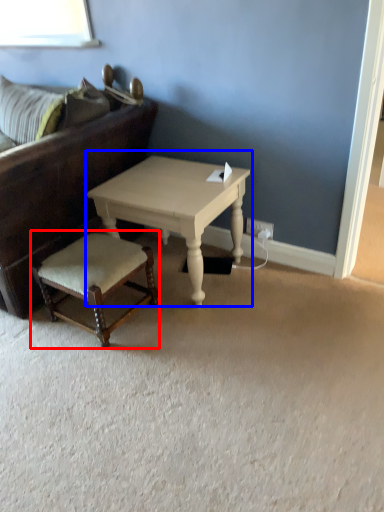
Question: Among these objects, which one is farthest to the camera, stool (highlighted by a red box) or coffee table (highlighted by a blue box)?

Choices:
 (A) stool
 (B) coffee table

Answer: (B)